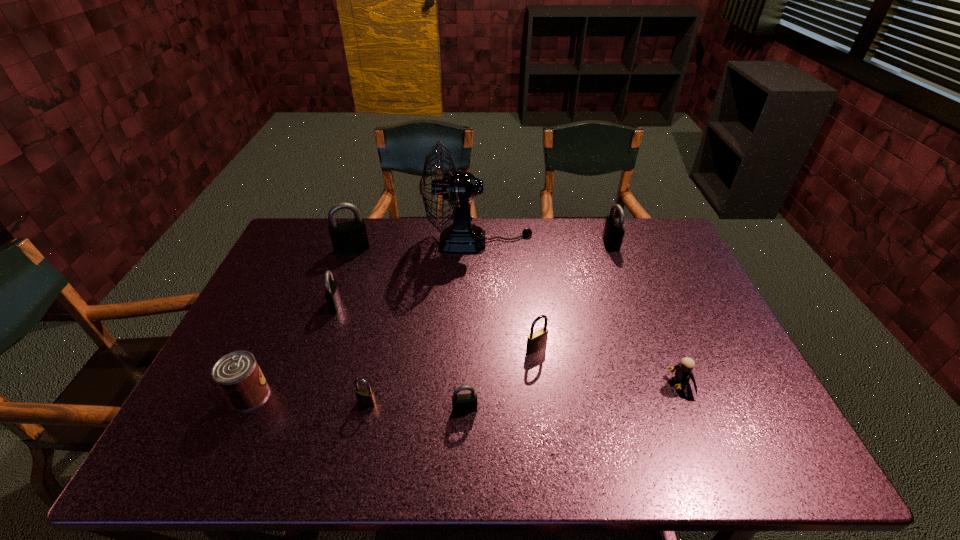
Identify the location of free spot located on the back of the third farthest padlock. (344, 282).

Locate an element on the screen. vacant space located 0.100m on the front of the leftmost object is located at coordinates (224, 453).

This screenshot has height=540, width=960. What are the coordinates of `vacant region located on the front-facing side of the Lego` in the screenshot? It's located at (603, 384).

Identify the location of free point located 0.160m on the front-facing side of the Lego. (603, 384).

This screenshot has height=540, width=960. Identify the location of free space located 0.200m on the front-facing side of the Lego. (587, 384).

This screenshot has width=960, height=540. In order to click on blank space located on the back of the nearer brass padlock in this screenshot , I will do `click(392, 289)`.

Identify the location of vacant space situated 0.060m on the back of the nearest black padlock. Image resolution: width=960 pixels, height=540 pixels. (466, 383).

This screenshot has width=960, height=540. Identify the location of fan situated at the far edge. (459, 188).

At what (x,y) coordinates should I click in order to perform the action: click on object at the left edge. Please return your answer as a coordinate pair (x, y). Looking at the image, I should click on (237, 374).

In order to click on object present at the right edge in this screenshot , I will do `click(683, 371)`.